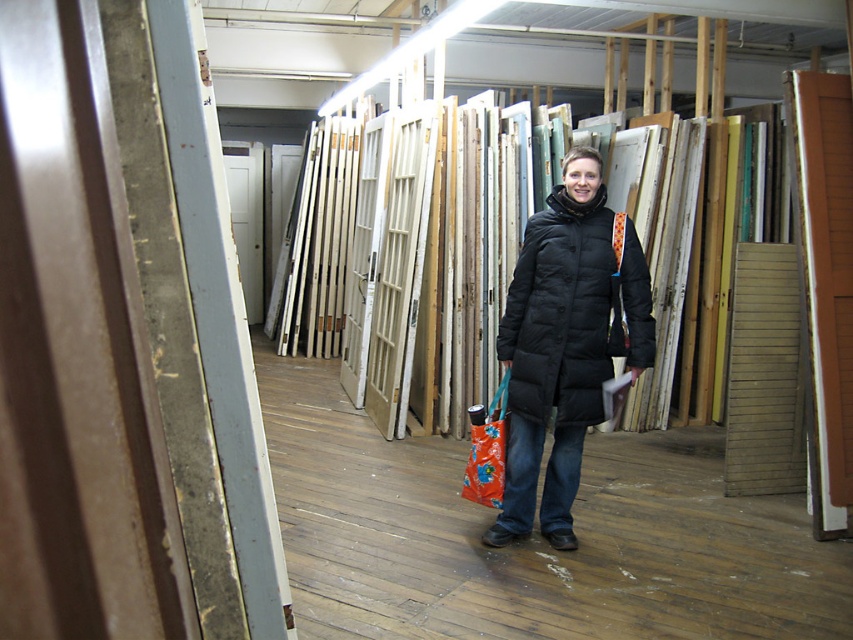
Question: Which of the following is the farthest from the observer?

Choices:
 (A) black quilted coat at center
 (B) orange fabric shopping bag at center

Answer: (B)

Question: Does black quilted coat at center appear under orange fabric shopping bag at center?

Choices:
 (A) yes
 (B) no

Answer: (B)

Question: Does black quilted coat at center have a greater width compared to orange fabric shopping bag at center?

Choices:
 (A) yes
 (B) no

Answer: (A)

Question: Can you confirm if black quilted coat at center is smaller than orange fabric shopping bag at center?

Choices:
 (A) yes
 (B) no

Answer: (B)

Question: Which point is closer to the camera?

Choices:
 (A) (500, 390)
 (B) (613, 317)

Answer: (B)